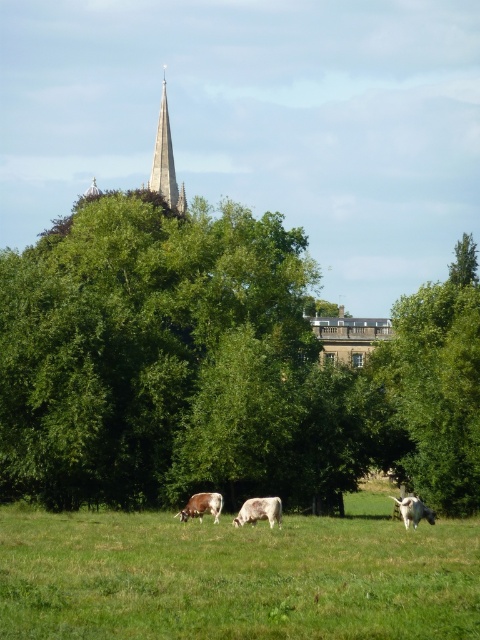
Question: Can you confirm if green leafy tree at upper center is positioned to the left of brown speckled cow at center?

Choices:
 (A) yes
 (B) no

Answer: (B)

Question: Which of the following is the closest to the observer?

Choices:
 (A) green grass at center
 (B) brown speckled cow at center
 (C) white smooth cow at center
 (D) green leafy tree at upper left

Answer: (A)

Question: Does green grass at center appear on the left side of brown speckled cow at center?

Choices:
 (A) no
 (B) yes

Answer: (A)

Question: Among these points, which one is nearest to the camera?

Choices:
 (A) (47, 374)
 (B) (447, 406)
 (C) (264, 568)

Answer: (C)

Question: Considering the real-world distances, which object is farthest from the white smooth cow at center?

Choices:
 (A) green leafy tree at upper left
 (B) white glossy cow at lower right
 (C) green leafy tree at upper center

Answer: (C)

Question: Is green grass at center to the left of smooth stone spire at upper center from the viewer's perspective?

Choices:
 (A) no
 (B) yes

Answer: (A)